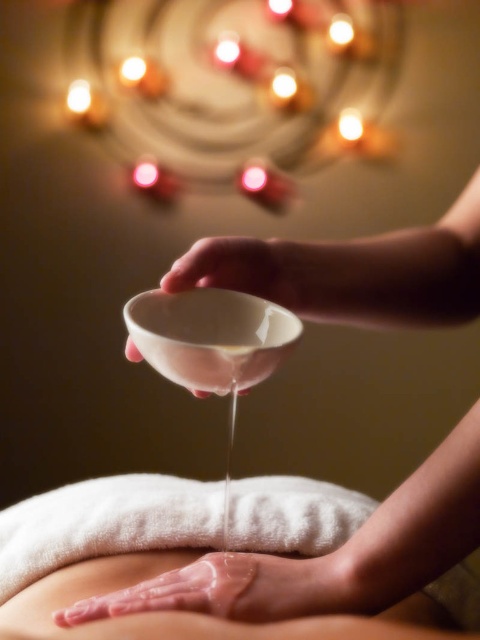
Question: Which of the following is the farthest from the observer?

Choices:
 (A) glossy skin at center
 (B) white porcelain bowl at center
 (C) translucent plastic bowl at upper center

Answer: (A)

Question: Which of the following is the farthest from the observer?

Choices:
 (A) (189, 317)
 (B) (224, 604)
 (C) (101, 604)

Answer: (A)

Question: Which of the following is the closest to the observer?

Choices:
 (A) translucent plastic bowl at upper center
 (B) white porcelain bowl at center
 (C) glossy skin at center

Answer: (B)

Question: Is white porcelain bowl at center closer to the viewer compared to glossy skin at center?

Choices:
 (A) no
 (B) yes

Answer: (B)

Question: Is translucent plastic bowl at upper center positioned behind white porcelain bowl at center?

Choices:
 (A) yes
 (B) no

Answer: (A)

Question: Does white porcelain bowl at center appear on the left side of glossy skin at center?

Choices:
 (A) no
 (B) yes

Answer: (A)